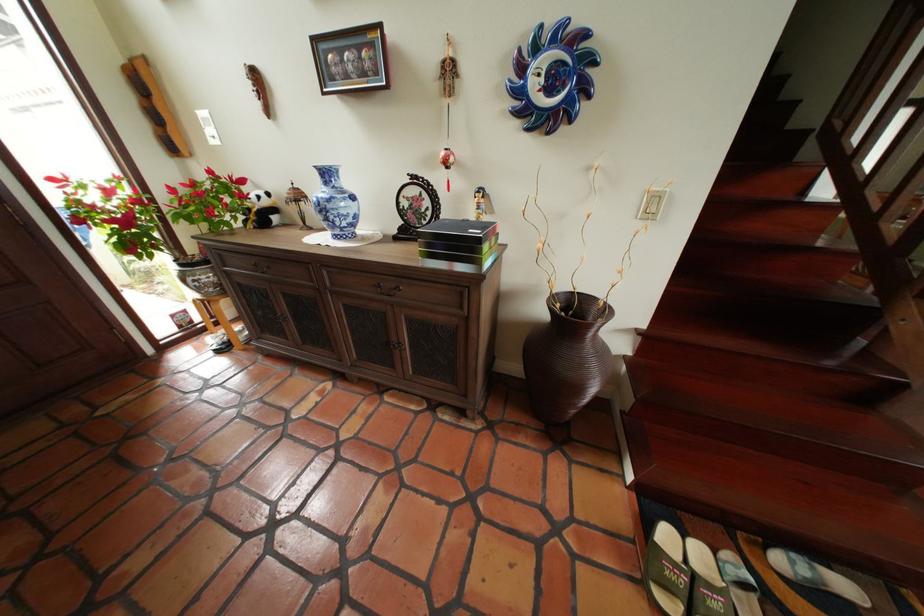
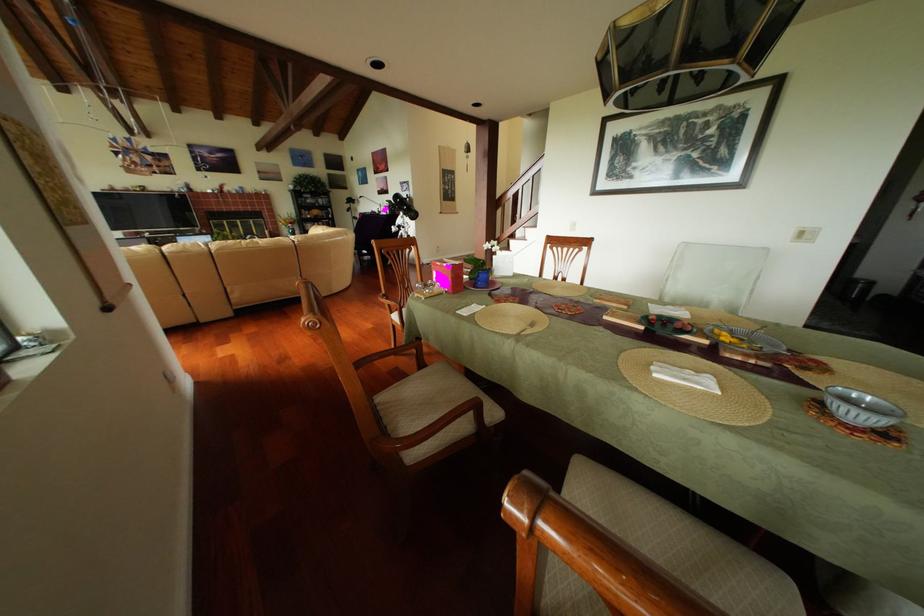
Question: I am providing you with two images of the same scene from different viewpoints. After the viewpoint changes to image2, which objects are now occluded?

Choices:
 (A) black mesh basket
 (B) large brown vase
 (C) clear glass bowl
 (D) wooden chair armrest

Answer: (B)